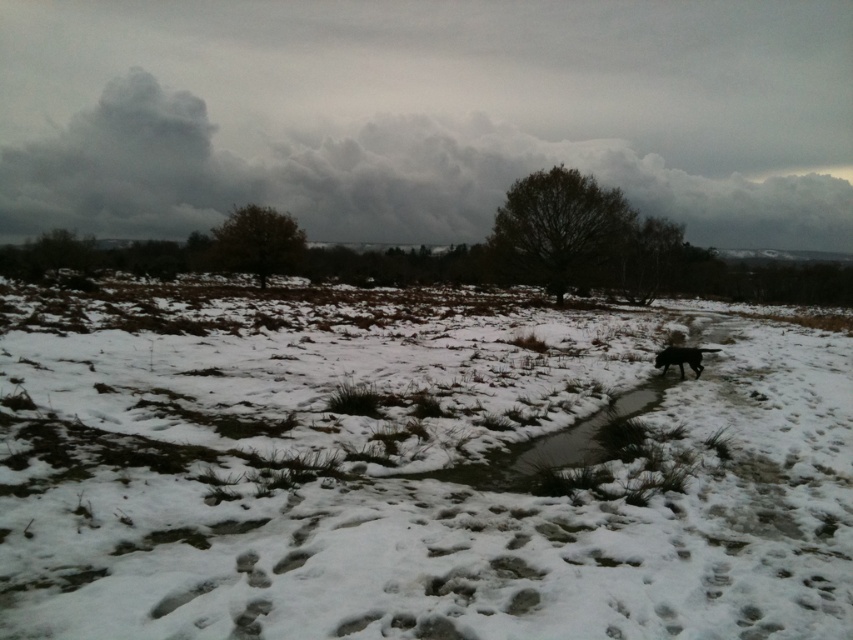
You are standing at the origin point of the image coordinate system and want to walk to the white fluffy snow at center. Which direction should you move in to reach it?

The white fluffy snow at center is located at point 0.733 on the x axis and 0.482 on the y axis. Since you are at the origin, you should move towards the positive x and positive y directions to reach it.

You are standing at the point with coordinates point [682,358] and want to walk to the point with coordinates point [827,404]. According to the image, will you have to walk towards the foreground or background?

→ Point [827,404] is in front of point [682,358], so you will have to walk towards the foreground.

You are standing in the winter scene and want to walk towards the black matte dog at right. Which direction should you move relative to the white fluffy snow at center?

You should move away from the white fluffy snow at center because the black matte dog at right is further away from the viewer than the snow.